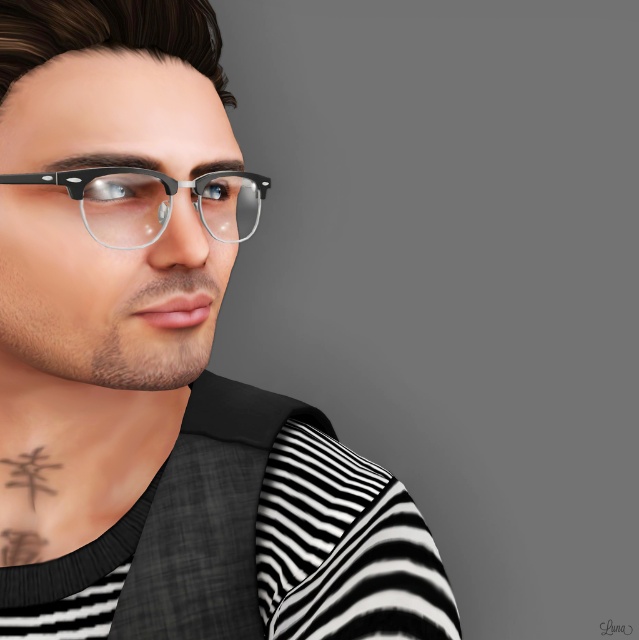
You are a fashion designer who needs to place a matte black vest at center and a matte black frame glasses at upper left in a showcase. If the showcase has a width limit of 30 cm, and the glasses take up 10 cm, will the vest fit alongside them?

The matte black vest at center is wider than the matte black frame glasses at upper left. Since the glasses take up 10 cm, the vest requires more space. The total width needed would exceed 30 cm, so they won not fit together in the showcase.

You are taking a photo of the person in the image. You want to focus on the point that is closer to the camera. Which point should you choose between point (x=20, y=157) and point (x=144, y=422)?

You should choose point (x=20, y=157) because it is closer to the camera than point (x=144, y=422).

You are a fashion designer observing the image. You need to determine which clothing item has a greater width between the matte black vest at center and the black striped shirt at center. Which one is wider?

The matte black vest at center is wider than the black striped shirt at center according to the description.